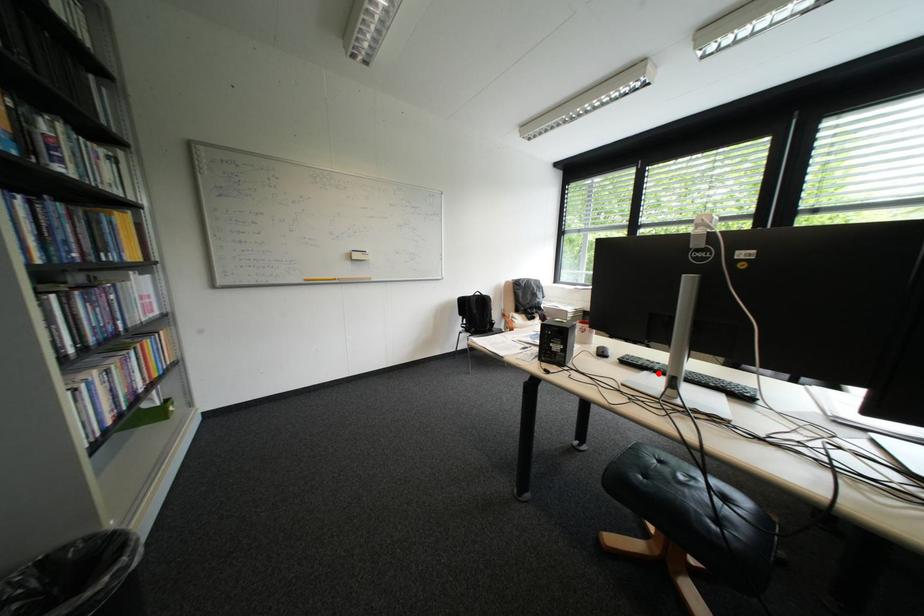
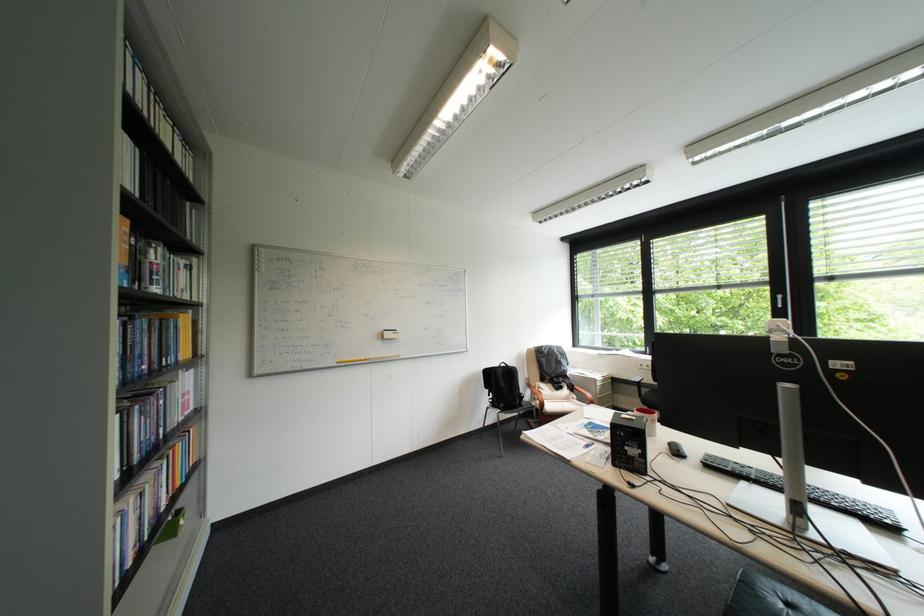
The point at the highlighted location is marked in the first image. Where is the corresponding point in the second image?

(757, 484)